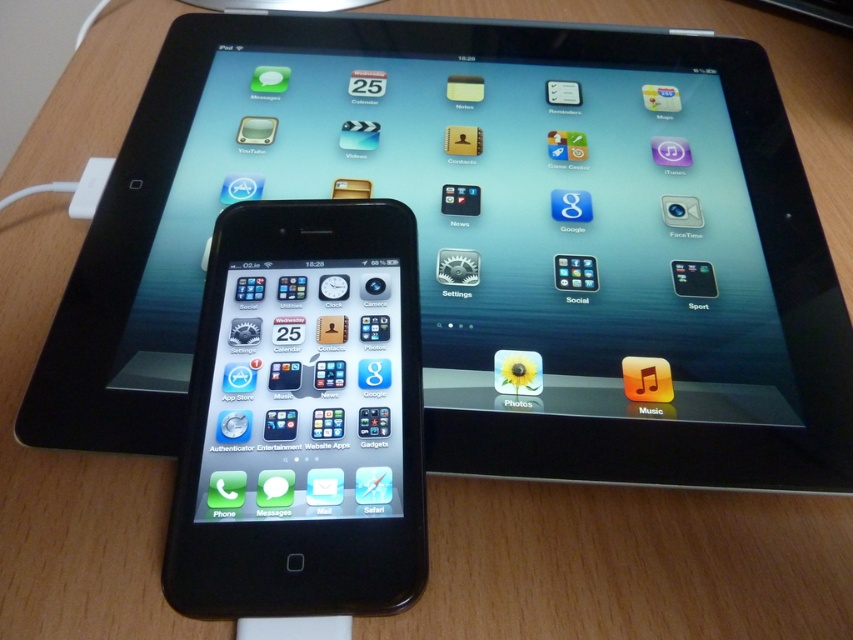
Is black glossy tablet at upper center closer to camera compared to black glossy tablet at center?

No, black glossy tablet at upper center is further to the viewer.

Who is more distant from viewer, [416,67] or [334,300]?

The point [416,67] is behind.

Find the location of a particular element. black glossy tablet at upper center is located at coordinates (489, 243).